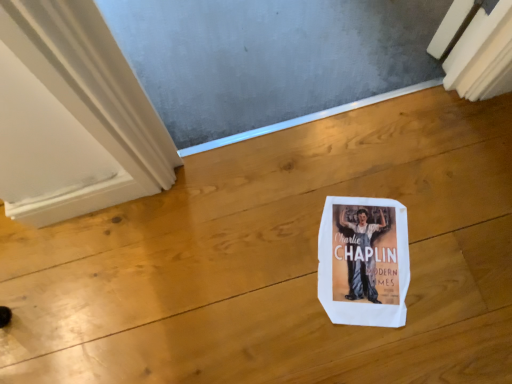
Locate an element on the screen. Image resolution: width=512 pixels, height=384 pixels. vacant area located to the right-hand side of white paper bag at center is located at coordinates (454, 239).